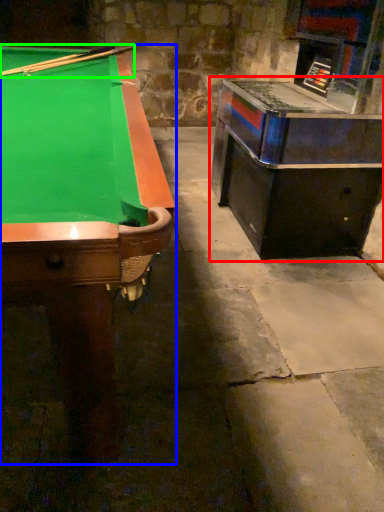
Question: Which is farther away from table (highlighted by a red box)? billiard table (highlighted by a blue box) or cue (highlighted by a green box)?

Choices:
 (A) billiard table
 (B) cue

Answer: (B)